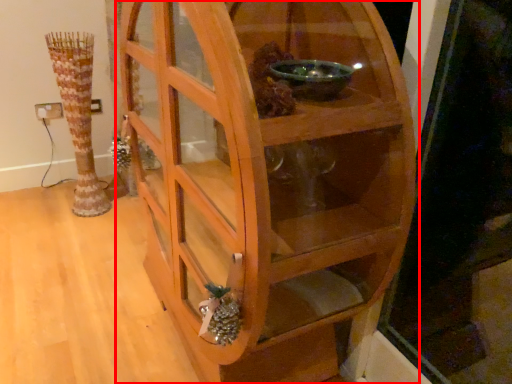
Question: From the image's perspective, where is shelf (annotated by the red box) located in relation to vase in the image?

Choices:
 (A) above
 (B) below

Answer: (B)